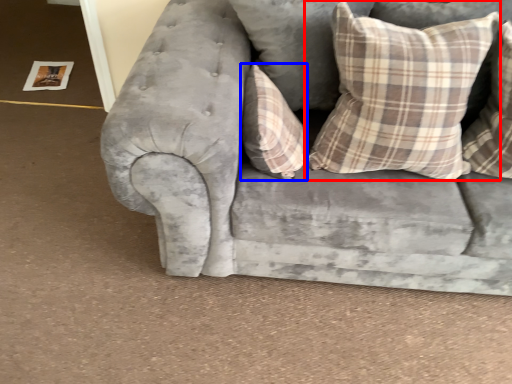
Question: Among these objects, which one is nearest to the camera, pillow (highlighted by a red box) or pillow (highlighted by a blue box)?

Choices:
 (A) pillow
 (B) pillow

Answer: (A)